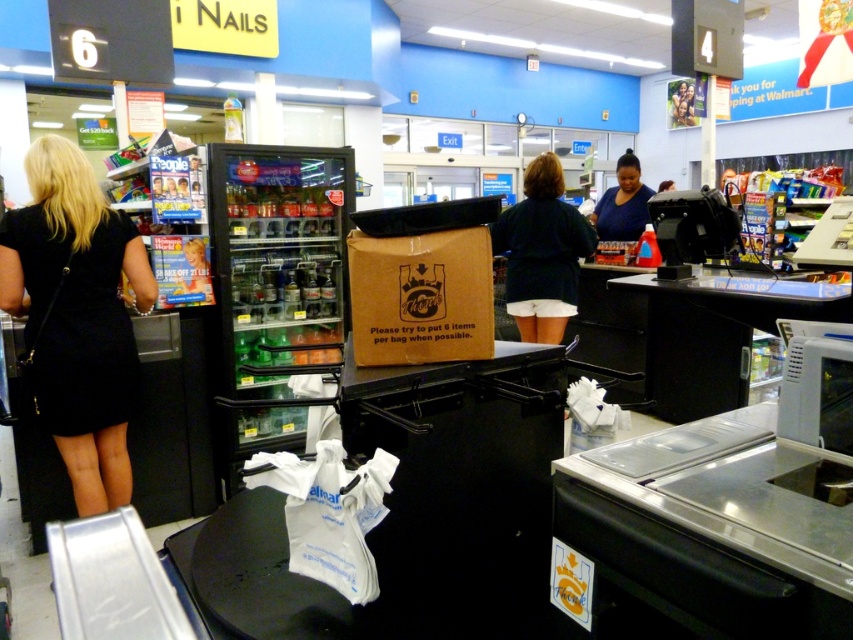
Question: Which point is closer to the camera?

Choices:
 (A) (606, 228)
 (B) (416, 339)

Answer: (B)

Question: Which object appears closest to the camera in this image?

Choices:
 (A) black matte dress at left
 (B) brown cardboard box at center

Answer: (B)

Question: Does brown cardboard box at center have a lesser width compared to blue matte shirt at center?

Choices:
 (A) no
 (B) yes

Answer: (B)

Question: From the image, what is the correct spatial relationship of black matte dress at left in relation to dark blue shirt at center?

Choices:
 (A) above
 (B) below

Answer: (B)

Question: Is black matte dress at left above brown cardboard box at center?

Choices:
 (A) yes
 (B) no

Answer: (B)

Question: Which object appears farthest from the camera in this image?

Choices:
 (A) dark blue shirt at center
 (B) black matte dress at left
 (C) blue matte shirt at center

Answer: (C)